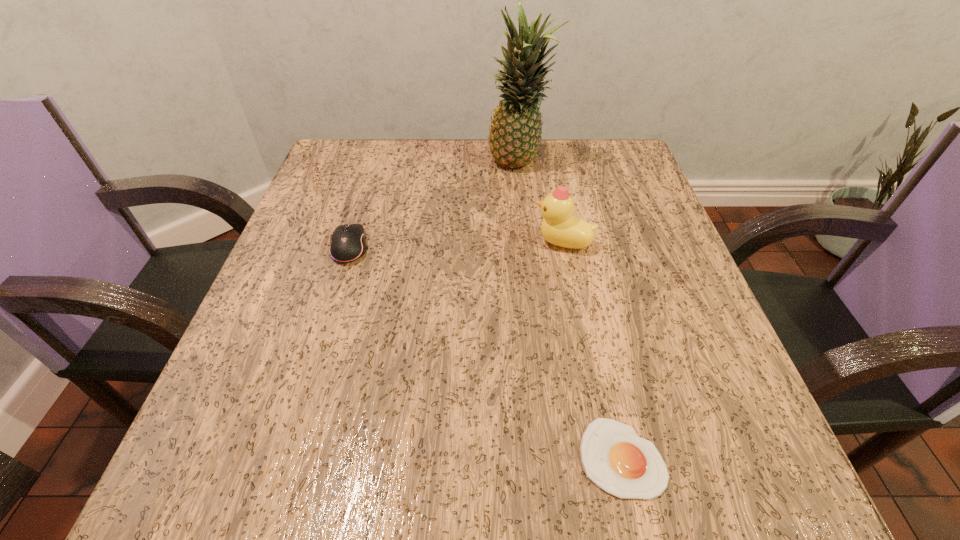
Find the location of a particular element. This screenshot has height=540, width=960. free space between the second shortest object and the egg yolk is located at coordinates (486, 352).

Where is `empty space that is in between the nearest object and the tallest object`? This screenshot has width=960, height=540. empty space that is in between the nearest object and the tallest object is located at coordinates (570, 311).

Locate an element on the screen. The width and height of the screenshot is (960, 540). vacant space in between the third tallest object and the nearest object is located at coordinates (486, 352).

Find the location of a particular element. The image size is (960, 540). vacant space that is in between the third shortest object and the leftmost object is located at coordinates (456, 245).

This screenshot has height=540, width=960. In order to click on object that stands as the third closest to the farthest object in this screenshot , I will do `click(623, 464)`.

Locate which object is the second closest to the leftmost object. Please provide its 2D coordinates. Your answer should be formatted as a tuple, i.e. [(x, y)], where the tuple contains the x and y coordinates of a point satisfying the conditions above.

[(560, 227)]

I want to click on blank space that satisfies the following two spatial constraints: 1. on the front side of the tallest object; 2. on the left side of the shortest object, so 553,457.

Image resolution: width=960 pixels, height=540 pixels. Find the location of `vacant area in the image that satisfies the following two spatial constraints: 1. on the front side of the pineapple; 2. on the left side of the egg yolk`. vacant area in the image that satisfies the following two spatial constraints: 1. on the front side of the pineapple; 2. on the left side of the egg yolk is located at coordinates (553, 457).

Identify the location of vacant position in the image that satisfies the following two spatial constraints: 1. on the front side of the egg yolk; 2. on the right side of the farthest object. click(553, 457).

Find the location of a particular element. free spot that satisfies the following two spatial constraints: 1. on the front-facing side of the shortest object; 2. on the left side of the second tallest object is located at coordinates (604, 457).